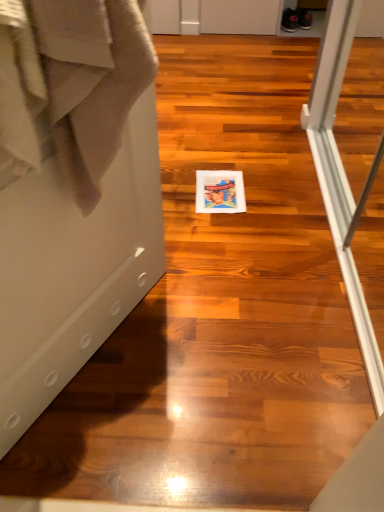
I want to click on empty space that is to the right of white glossy screen door at center, so click(x=224, y=358).